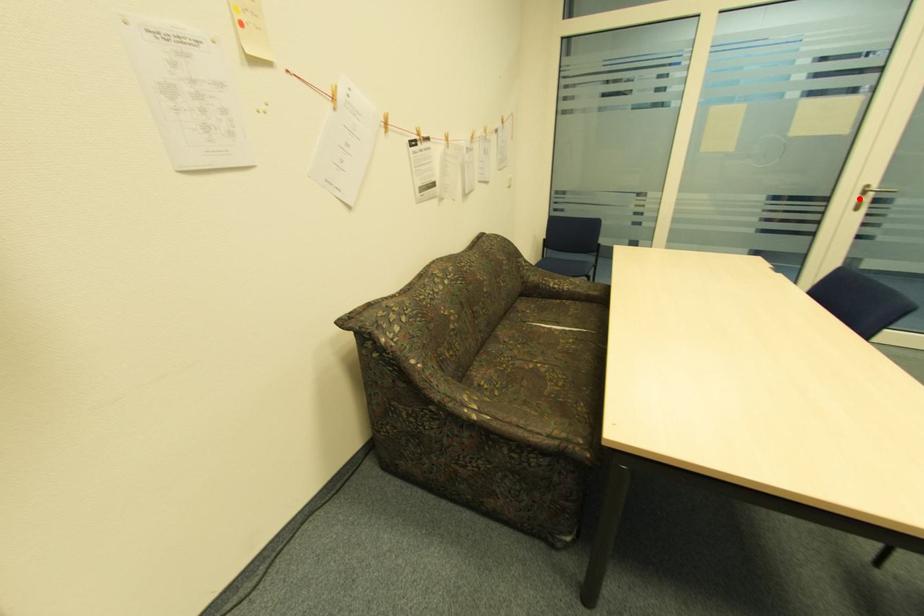
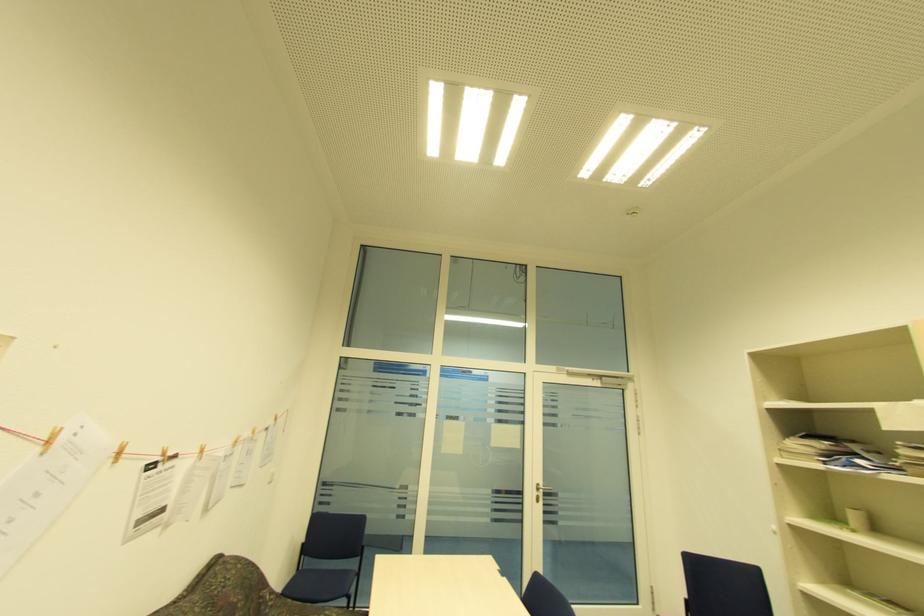
Question: I am providing you with two images of the same scene from different viewpoints. A red point is shown in image1. For the corresponding object point in image2, is it positioned nearer or farther from the camera?

Choices:
 (A) Nearer
 (B) Farther

Answer: (B)